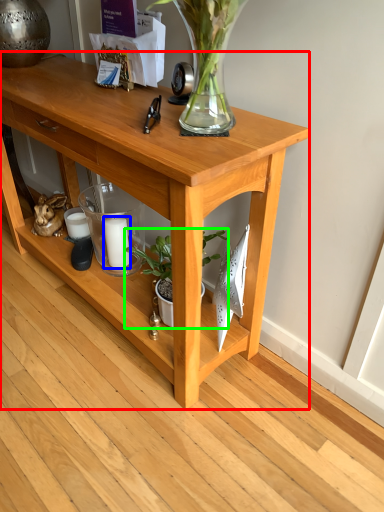
Question: Considering the real-world distances, which object is closest to table (highlighted by a red box)? candle (highlighted by a blue box) or houseplant (highlighted by a green box).

Choices:
 (A) candle
 (B) houseplant

Answer: (B)